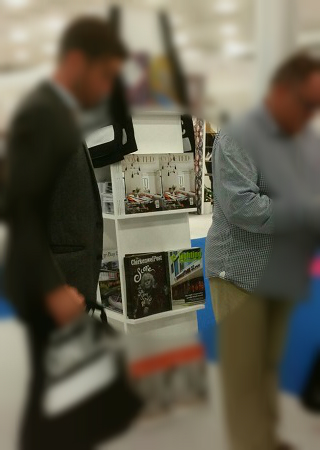
Locate an element on the screen. blurred lights on ceiling is located at coordinates (217, 21).